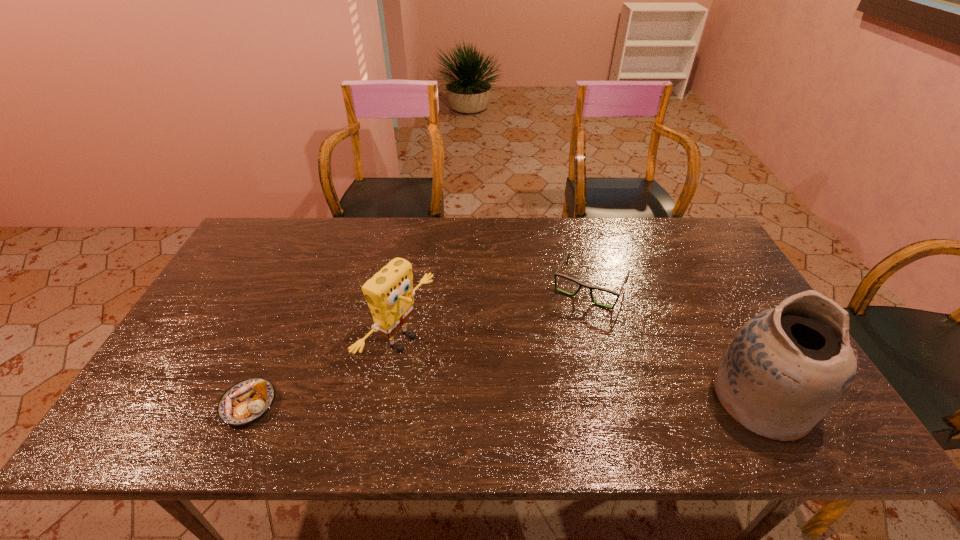
At what (x,y) coordinates should I click in order to perform the action: click on free space located 0.330m on the lens of the second object from right to left. Please return your answer as a coordinate pair (x, y). Looking at the image, I should click on (531, 398).

I want to click on vacant area situated on the lens of the second object from right to left, so click(x=540, y=379).

Locate an element on the screen. The image size is (960, 540). vacant space located 0.190m on the lens of the second object from right to left is located at coordinates (552, 356).

Where is `free location located on the face of the sponge`? This screenshot has height=540, width=960. free location located on the face of the sponge is located at coordinates (480, 390).

Where is `pastry located at the near edge`? This screenshot has height=540, width=960. pastry located at the near edge is located at coordinates (245, 402).

I want to click on pottery located at the near edge, so click(785, 369).

The width and height of the screenshot is (960, 540). I want to click on sponge present at the near edge, so click(389, 293).

Locate an element on the screen. The width and height of the screenshot is (960, 540). object positioned at the right edge is located at coordinates (785, 369).

Where is `object that is at the near right corner`? object that is at the near right corner is located at coordinates [785, 369].

Locate an element on the screen. Image resolution: width=960 pixels, height=540 pixels. free location at the far edge of the desktop is located at coordinates (371, 226).